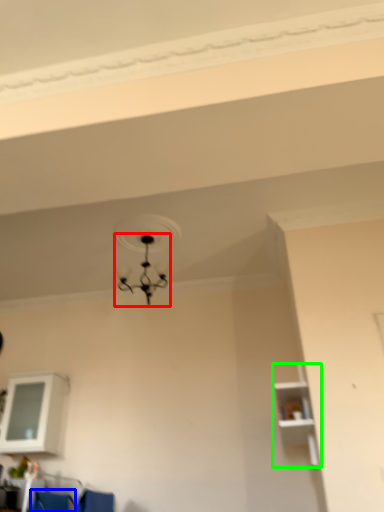
Question: Which object is the farthest from lamp (highlighted by a red box)? Choose among these: armchair (highlighted by a blue box) or shelf (highlighted by a green box).

Choices:
 (A) armchair
 (B) shelf

Answer: (A)